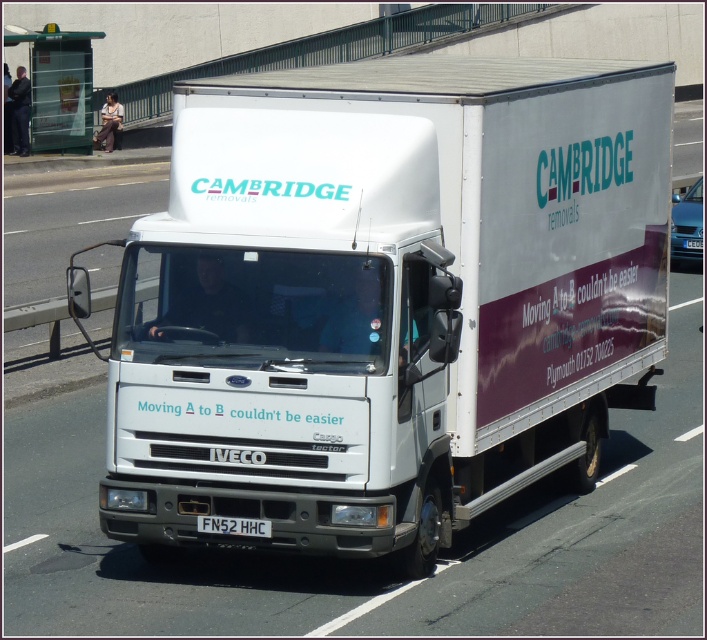
Question: Which of the following is the farthest from the observer?

Choices:
 (A) (300, 156)
 (B) (264, 524)

Answer: (A)

Question: Can you confirm if white matte truck at center is thinner than white plastic license plate at center?

Choices:
 (A) no
 (B) yes

Answer: (B)

Question: Can you confirm if white matte truck at center is bigger than white plastic license plate at center?

Choices:
 (A) no
 (B) yes

Answer: (B)

Question: Does white matte truck at center appear under white plastic license plate at center?

Choices:
 (A) no
 (B) yes

Answer: (A)